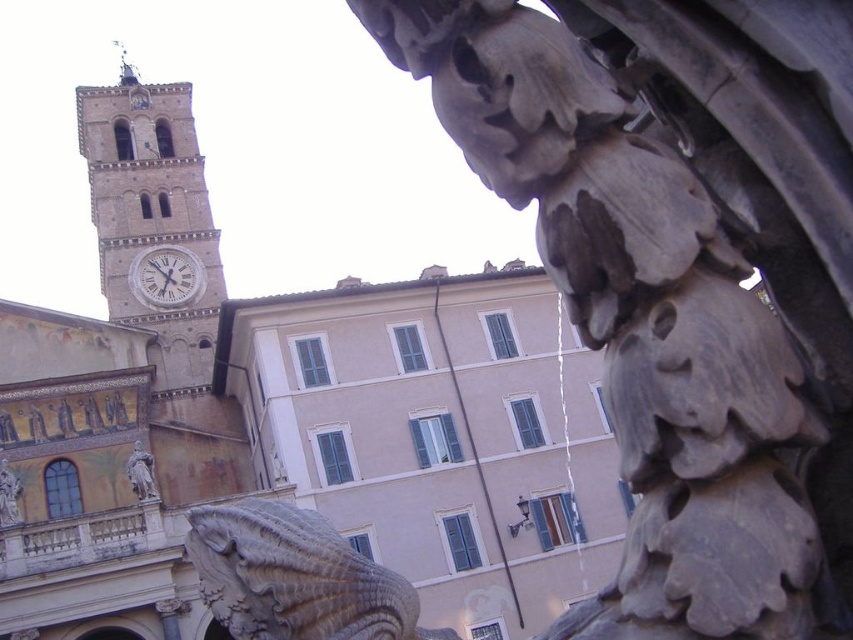
Does gray stone sculpture at center have a greater width compared to white marble clock at upper left?

No, gray stone sculpture at center is not wider than white marble clock at upper left.

Is point (672, 120) positioned behind point (155, 301)?

That is False.

Is point (796, 225) behind point (161, 273)?

No, it is in front of (161, 273).

Where is `gray stone sculpture at center`? The width and height of the screenshot is (853, 640). gray stone sculpture at center is located at coordinates (683, 275).

Find the location of a particular element. This screenshot has width=853, height=640. brown stone clock tower at upper left is located at coordinates (154, 220).

Where is `brown stone clock tower at upper left`? The image size is (853, 640). brown stone clock tower at upper left is located at coordinates (154, 220).

Does gray stone sculpture at center have a lesser width compared to carved stone lion at lower left?

Indeed, gray stone sculpture at center has a lesser width compared to carved stone lion at lower left.

Is gray stone sculpture at center positioned behind carved stone lion at lower left?

No, it is not.

Who is more forward, (763, 225) or (270, 605)?

Point (763, 225)

Identify the location of gray stone sculpture at center. (683, 275).